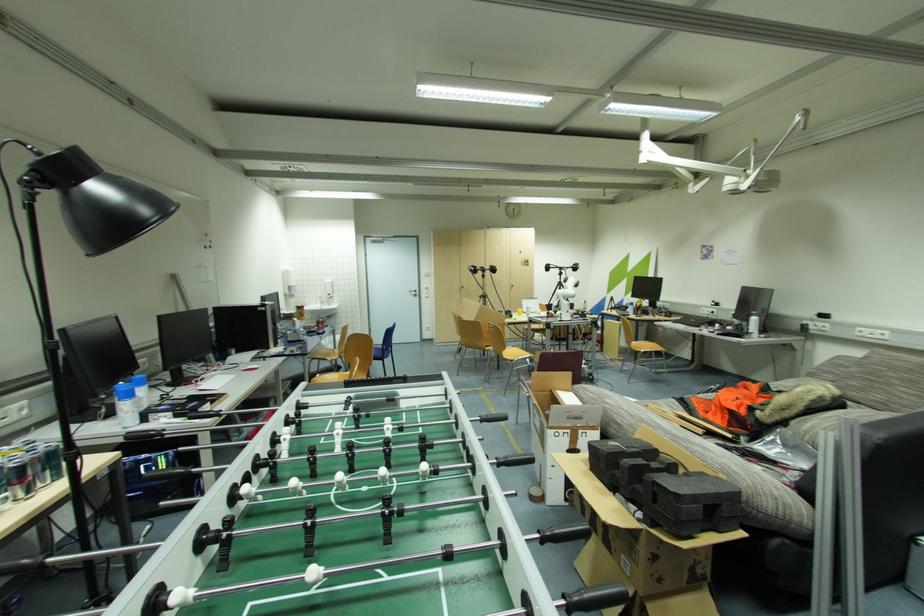
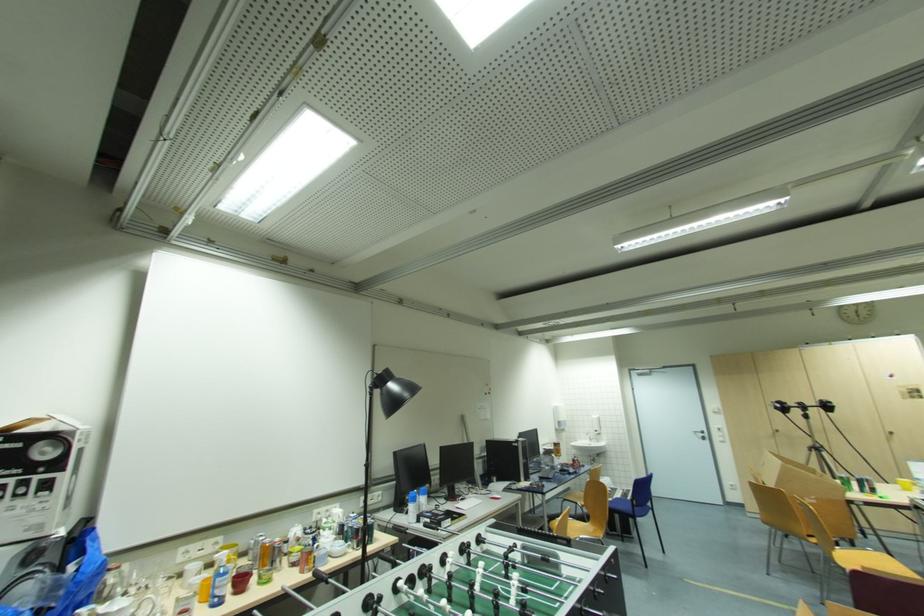
Locate, in the second image, the point that corresponds to the point at 418,294 in the first image.

(706, 436)